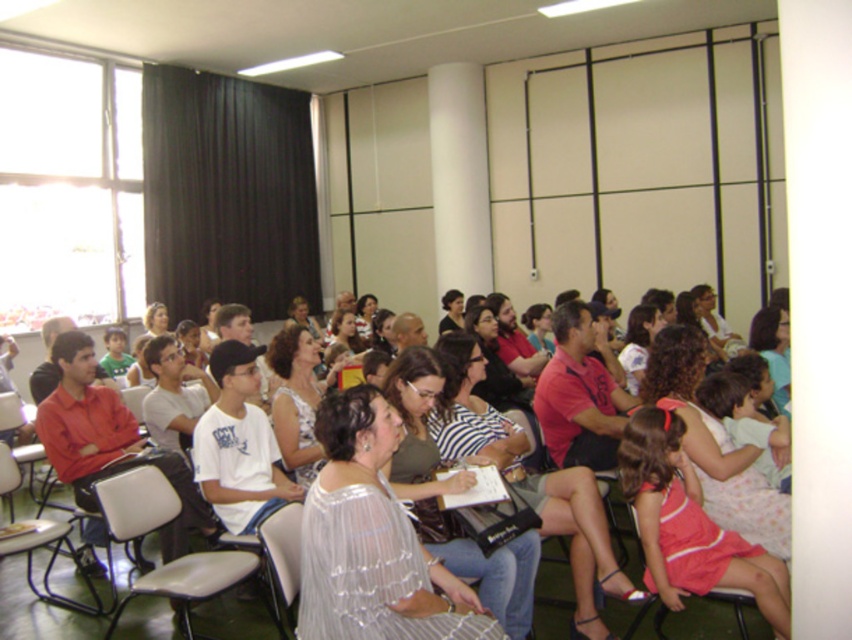
You are attending a seminar and need to sit in a chair that is taller than the other. Which chair should you choose between the gray plastic chair at center and the matte black chair at center?

The gray plastic chair at center is much taller than the matte black chair at center, so you should choose the gray plastic chair at center.

You are an event planner organizing a photoshoot in the room. You need to decide which object between the black fabric curtain at upper left and the matte pink fabric chair at lower right can be moved to create more space. Which one would be easier to move?

The matte pink fabric chair at lower right would be easier to move because it is smaller in size than the black fabric curtain at upper left.